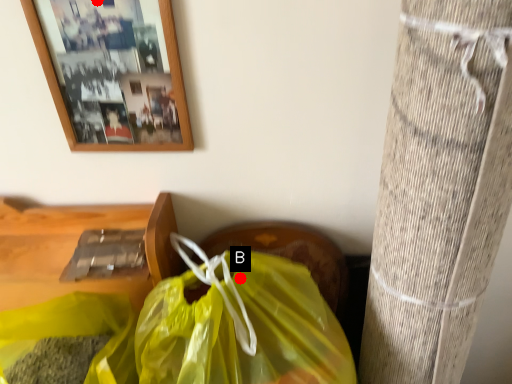
Question: Two points are circled on the image, labeled by A and B beside each circle. Which point is closer to the camera taking this photo?

Choices:
 (A) A is closer
 (B) B is closer

Answer: (A)